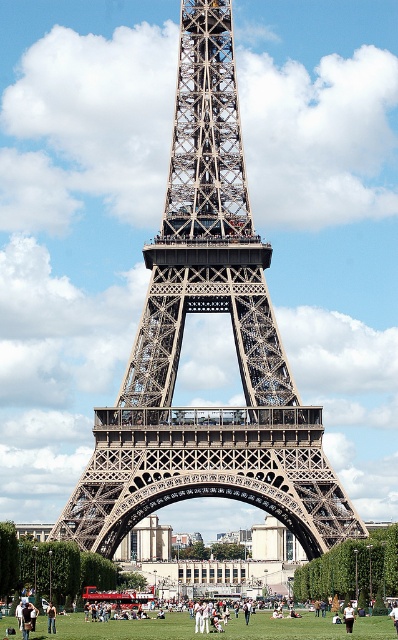
Question: Among these objects, which one is nearest to the camera?

Choices:
 (A) green grass at lower center
 (B) white cotton shirt at center
 (C) metallic lattice structure at center

Answer: (A)

Question: Based on their relative distances, which object is farther from the skinny jeans at center?

Choices:
 (A) metallic lattice structure at center
 (B) green grass at lower center
 (C) white cotton shirt at center

Answer: (A)

Question: Can you confirm if metallic lattice structure at center is wider than green grass at center?

Choices:
 (A) yes
 (B) no

Answer: (B)

Question: Which object is closer to the camera taking this photo?

Choices:
 (A) green grass at lower center
 (B) skinny jeans at center
 (C) metallic lattice structure at center

Answer: (A)

Question: Can you confirm if green grass at center is smaller than skinny jeans at center?

Choices:
 (A) yes
 (B) no

Answer: (B)

Question: In this image, where is green grass at center located relative to skinny jeans at center?

Choices:
 (A) right
 (B) left

Answer: (A)